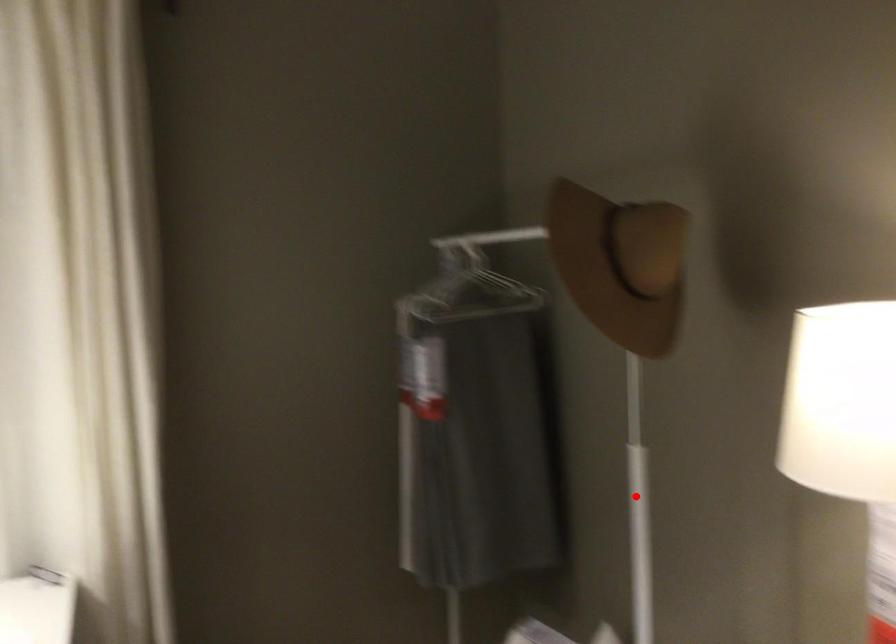
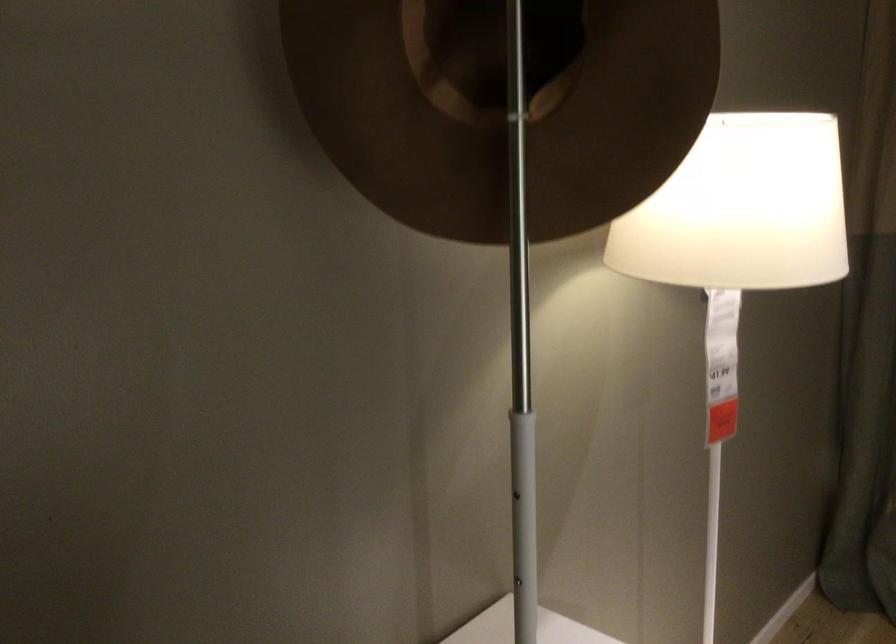
The point at the highlighted location is marked in the first image. Where is the corresponding point in the second image?

(522, 503)